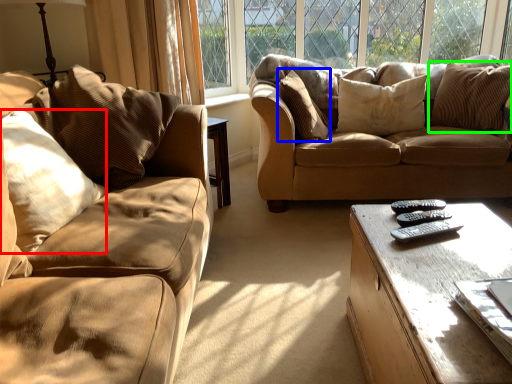
Question: Which object is positioned farthest from pillow (highlighted by a red box)? Select from pillow (highlighted by a blue box) and pillow (highlighted by a green box).

Choices:
 (A) pillow
 (B) pillow

Answer: (B)